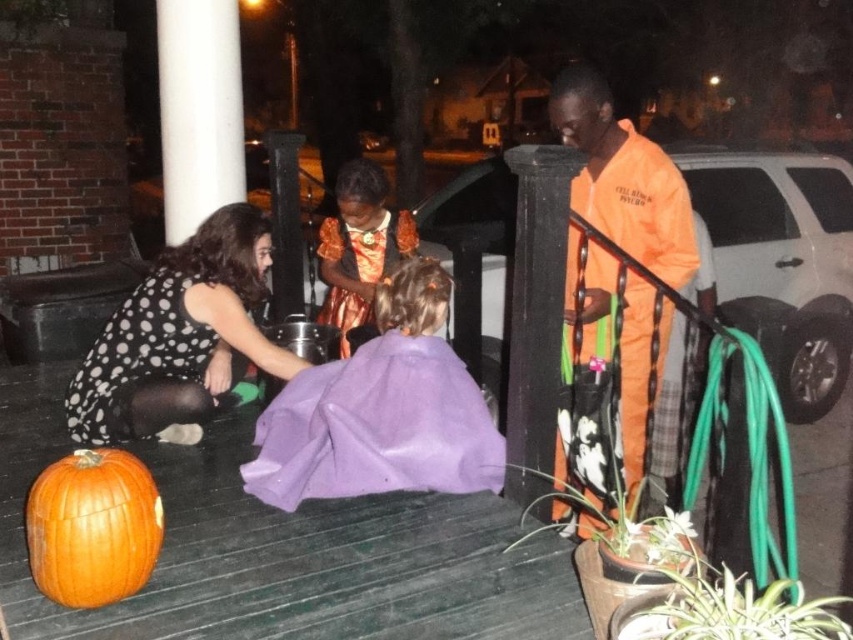
You are a photographer positioned on the porch and want to capture a photo of the orange jumpsuit at right and the orange matte pumpkin at lower left. Which object should you focus on first if you want to ensure both are in focus, considering their heights?

The orange jumpsuit at right is taller than the orange matte pumpkin at lower left, so focusing on the orange jumpsuit at right first would help ensure both are in focus since it is the taller object.